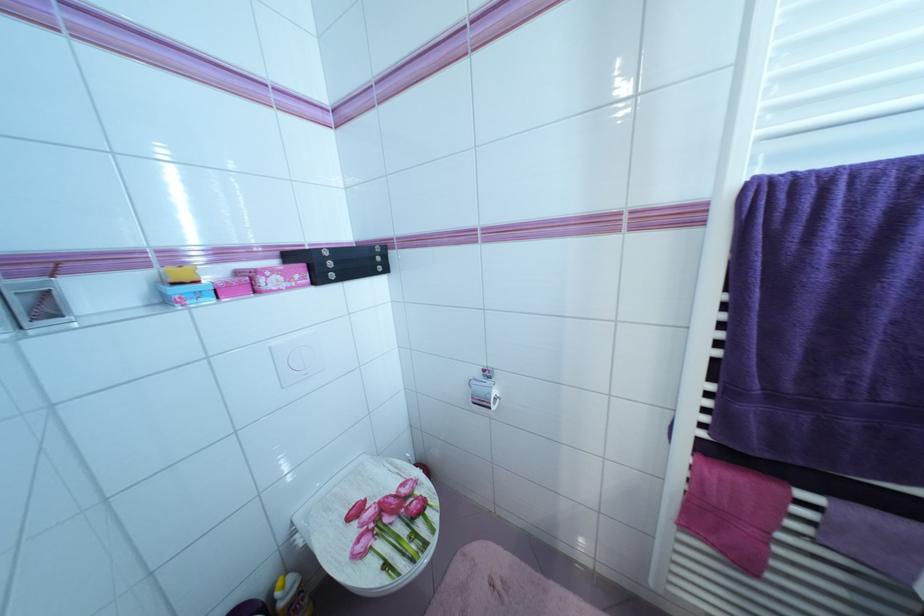
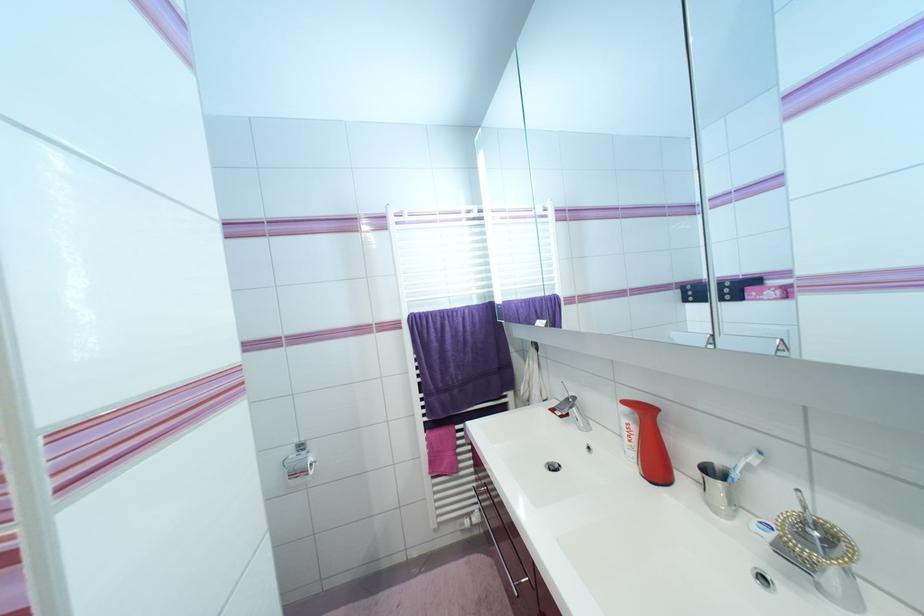
Question: How did the camera likely rotate?

Choices:
 (A) Left
 (B) Right
 (C) Up
 (D) Down

Answer: (B)